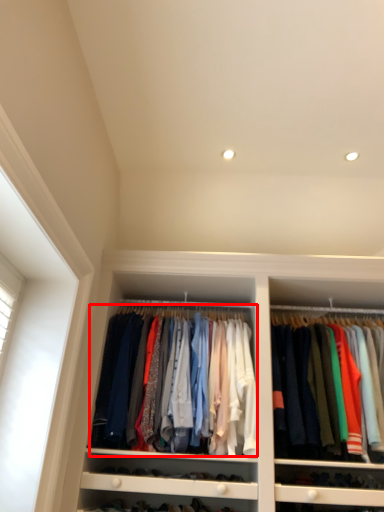
Question: From the image's perspective, what is the correct spatial positioning of clothing (annotated by the red box) in reference to clothing?

Choices:
 (A) above
 (B) below

Answer: (A)